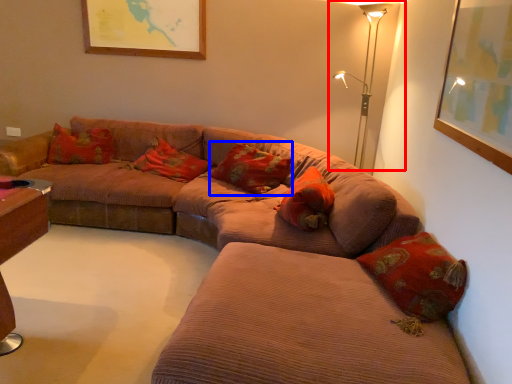
Question: Among these objects, which one is farthest to the camera, table lamp (highlighted by a red box) or pillow (highlighted by a blue box)?

Choices:
 (A) table lamp
 (B) pillow

Answer: (B)